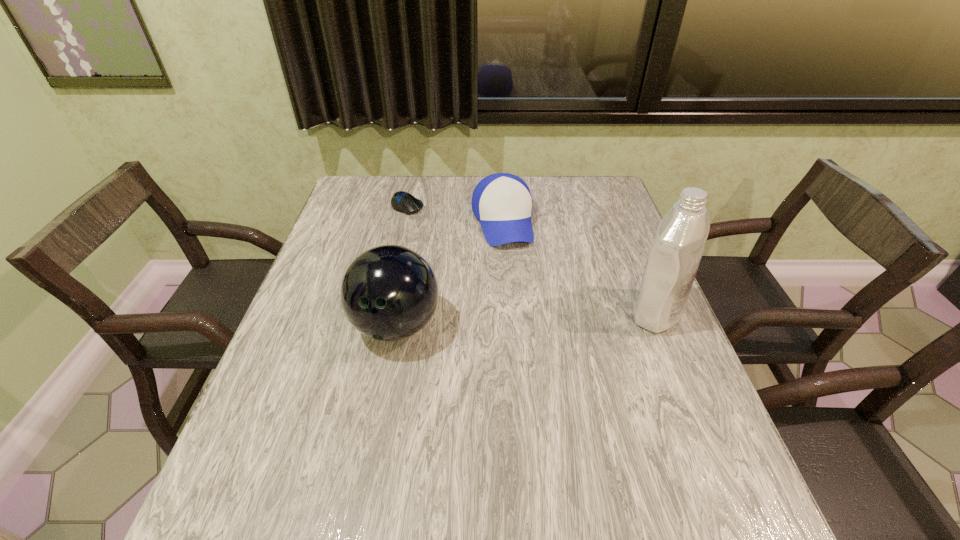
At what (x,y) coordinates should I click in order to perform the action: click on vacant region at the far edge of the desktop. Please return your answer as a coordinate pair (x, y). The width and height of the screenshot is (960, 540). Looking at the image, I should click on [455, 200].

The height and width of the screenshot is (540, 960). In the image, there is a desktop. In order to click on free region at the near edge in this screenshot , I will do `click(423, 477)`.

You are a GUI agent. You are given a task and a screenshot of the screen. Output one action in this format:
    pyautogui.click(x=<x>, y=<y>)
    Task: Click on the free point at the left edge
    The height and width of the screenshot is (540, 960).
    Given the screenshot: What is the action you would take?
    pyautogui.click(x=265, y=401)

Locate an element on the screen. This screenshot has width=960, height=540. vacant space at the right edge of the desktop is located at coordinates (615, 307).

Identify the location of vacant space at the far left corner of the desktop. The height and width of the screenshot is (540, 960). coord(348,207).

Locate an element on the screen. vacant space at the far right corner of the desktop is located at coordinates (602, 202).

Locate an element on the screen. empty location between the computer mouse and the tallest object is located at coordinates (532, 259).

At what (x,y) coordinates should I click in order to perform the action: click on free space between the second shortest object and the rightmost object. Please return your answer as a coordinate pair (x, y). This screenshot has width=960, height=540. Looking at the image, I should click on (579, 267).

Locate an element on the screen. The image size is (960, 540). vacant area that lies between the third shortest object and the second object from right to left is located at coordinates (449, 273).

Find the location of `free spot between the detergent and the second object from right to left`. free spot between the detergent and the second object from right to left is located at coordinates (579, 267).